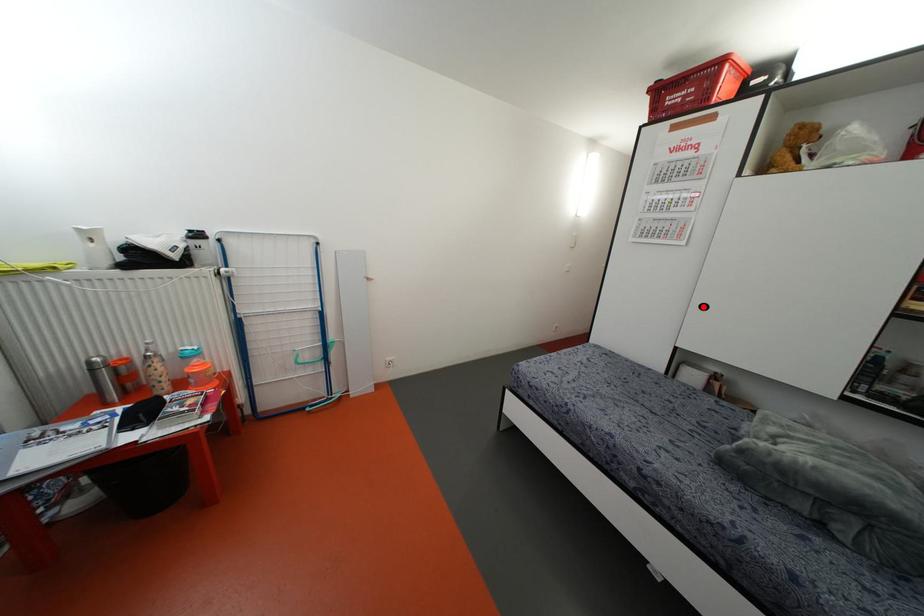
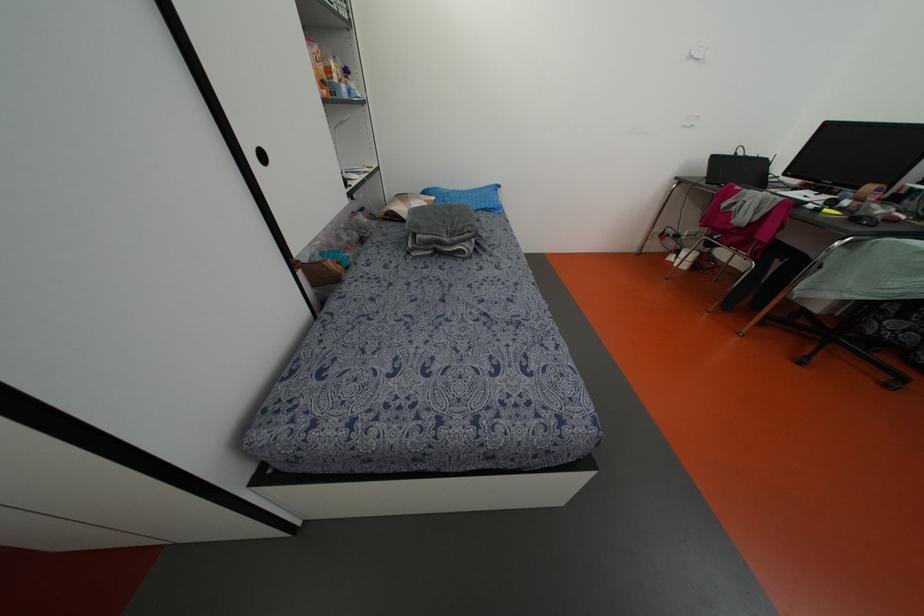
The point at the highlighted location is marked in the first image. Where is the corresponding point in the second image?

(262, 156)